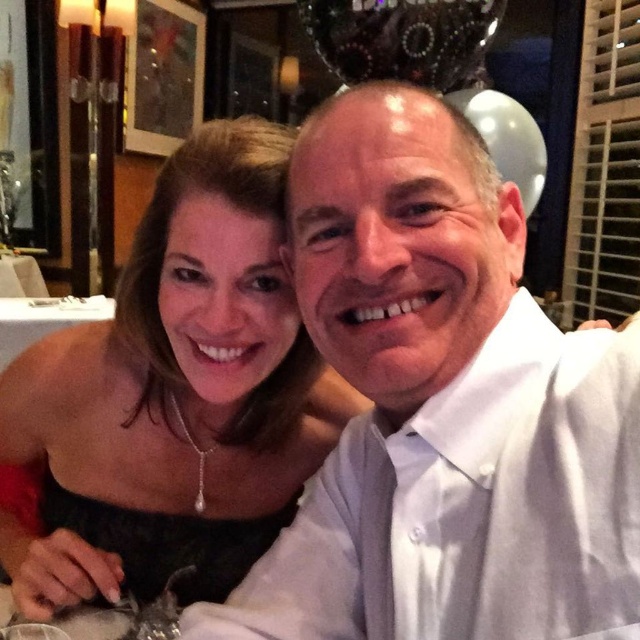
Between white smooth shirt at center and black satin dress at upper left, which one has more height?

Standing taller between the two is black satin dress at upper left.

The image size is (640, 640). Describe the element at coordinates (442, 406) in the screenshot. I see `white smooth shirt at center` at that location.

I want to click on white smooth shirt at center, so click(442, 406).